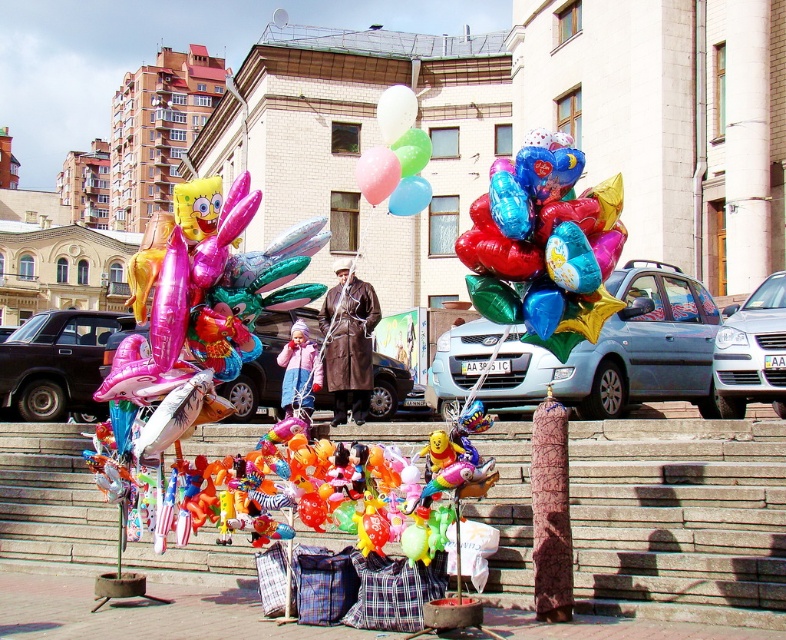
You are standing at the bottom of the staircase in the street scene. You see two points marked in the image. Which point is closer to you, point (399, 205) or point (390, 109)?

Point (399, 205) is in front of point (390, 109), so it is closer to you.

Looking at this image, you are a child who wants to pick up the translucent glossy balloons at center and the translucent plastic balloon at center. Which one is easier to reach?

The translucent glossy balloons at center is easier to reach because it is located below the translucent plastic balloon at center.

You are a photographer trying to capture the perfect shot of the shiny metallic balloons at center. You notice that the balloons are tied to a pole located at point (544, 244). To avoid including the pole in your photo, where should you position yourself relative to the balloons?

The shiny metallic balloons at center are located at point (544, 244). To avoid the pole, position yourself so that the pole is out of the frame, perhaps by moving to the side or adjusting your angle to exclude the pole from the shot.